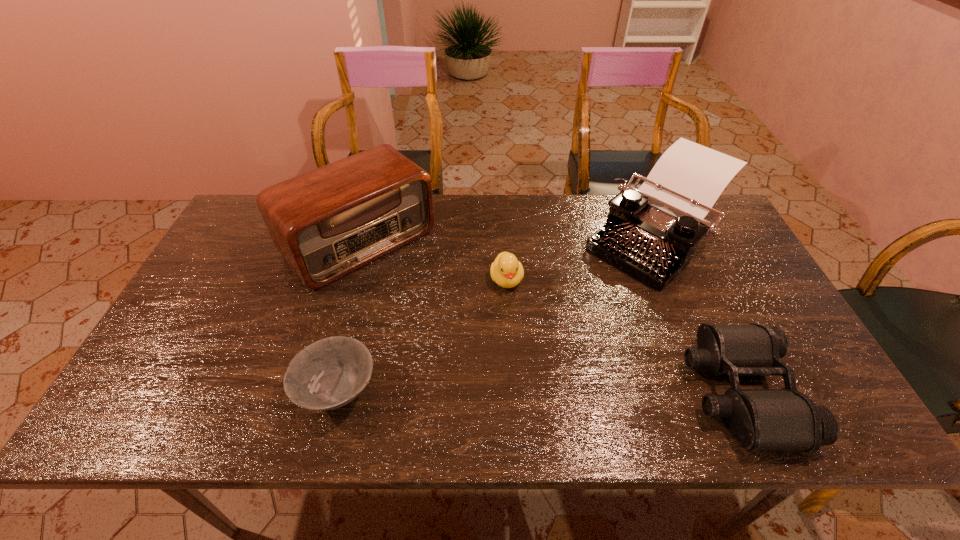
Find the location of a particular element. Image resolution: width=960 pixels, height=540 pixels. free space at the far left corner of the desktop is located at coordinates (256, 214).

Identify the location of free space between the bowl and the radio receiver. (349, 318).

The width and height of the screenshot is (960, 540). Identify the location of free space between the radio receiver and the typewriter. (508, 240).

This screenshot has width=960, height=540. Identify the location of vacant region between the duckling and the bowl. (422, 336).

The width and height of the screenshot is (960, 540). Identify the location of vacant area that lies between the radio receiver and the typewriter. (508, 240).

Image resolution: width=960 pixels, height=540 pixels. What are the coordinates of `empty space that is in between the third object from right to left and the binoculars` in the screenshot? It's located at (623, 335).

You are a GUI agent. You are given a task and a screenshot of the screen. Output one action in this format:
    pyautogui.click(x=<x>, y=<y>)
    Task: Click on the free space between the bowl and the typewriter
    Image resolution: width=960 pixels, height=540 pixels.
    Given the screenshot: What is the action you would take?
    pyautogui.click(x=497, y=315)

Find the location of a particular element. free point between the binoculars and the radio receiver is located at coordinates (550, 317).

What are the coordinates of `vacant area that lies between the bowl and the typewriter` in the screenshot? It's located at (497, 315).

Where is `unoccupied position between the bowl and the binoculars`? This screenshot has width=960, height=540. unoccupied position between the bowl and the binoculars is located at coordinates (540, 392).